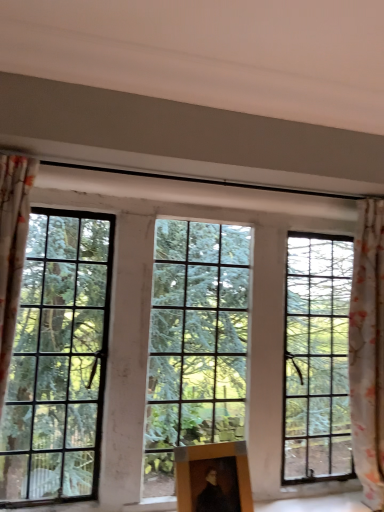
Question: In terms of size, does floral fabric curtain at right appear bigger or smaller than wooden picture frame at center?

Choices:
 (A) small
 (B) big

Answer: (B)

Question: Considering the positions of floral fabric curtain at right and wooden picture frame at center in the image, is floral fabric curtain at right taller or shorter than wooden picture frame at center?

Choices:
 (A) tall
 (B) short

Answer: (A)

Question: Based on their relative distances, which object is nearer to the clear glass window at center?

Choices:
 (A) floral fabric curtain at right
 (B) wooden picture frame at center

Answer: (B)

Question: Which object is positioned farthest from the wooden picture frame at center?

Choices:
 (A) clear glass window at center
 (B) floral fabric curtain at right

Answer: (B)